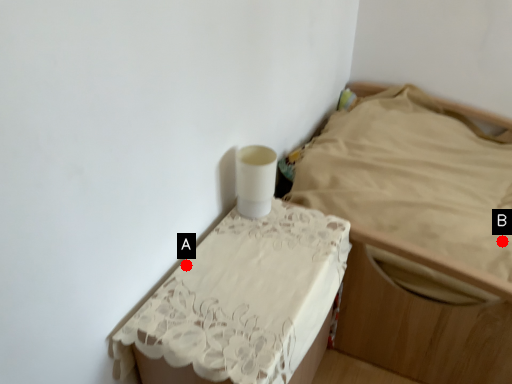
Question: Two points are circled on the image, labeled by A and B beside each circle. Which of the following is the farthest from the observer?

Choices:
 (A) A is further
 (B) B is further

Answer: (B)